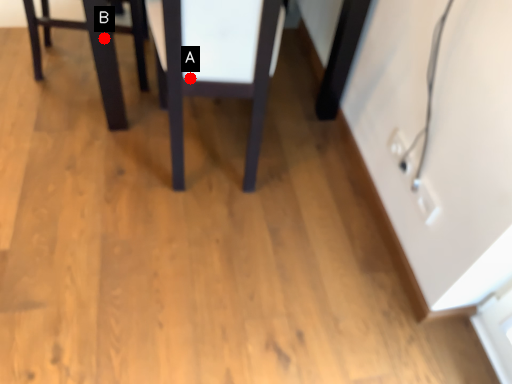
Question: Two points are circled on the image, labeled by A and B beside each circle. Which point is farther to the camera?

Choices:
 (A) A is further
 (B) B is further

Answer: (B)